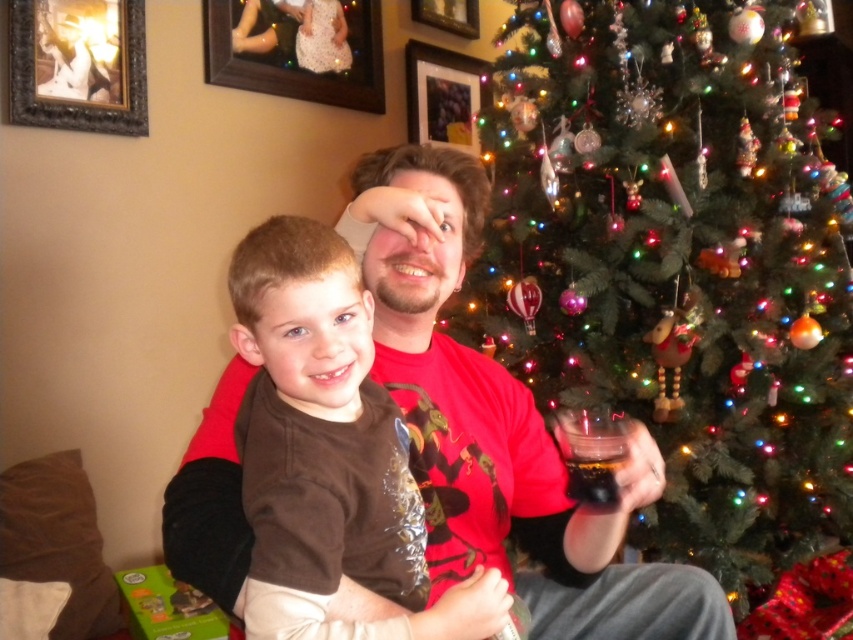
Can you confirm if red matte shirt at center is positioned to the left of metallic silver frame at upper center?

Indeed, red matte shirt at center is positioned on the left side of metallic silver frame at upper center.

Between point (456, 180) and point (444, 72), which one is positioned behind?

The point (444, 72) is behind.

This screenshot has width=853, height=640. I want to click on red matte shirt at center, so click(498, 426).

This screenshot has width=853, height=640. I want to click on red matte shirt at center, so click(498, 426).

Who is lower down, red matte shirt at center or matte glass picture frame at upper center?

red matte shirt at center

Who is more distant from viewer, (x=613, y=540) or (x=367, y=8)?

Positioned behind is point (x=367, y=8).

This screenshot has width=853, height=640. Identify the location of red matte shirt at center. (498, 426).

Is matte glass picture frame at upper center above translucent plastic cup at right?

Yes, matte glass picture frame at upper center is above translucent plastic cup at right.

Which is more to the left, matte glass picture frame at upper center or translucent plastic cup at right?

matte glass picture frame at upper center is more to the left.

What do you see at coordinates (297, 49) in the screenshot? This screenshot has width=853, height=640. I see `matte glass picture frame at upper center` at bounding box center [297, 49].

Find the location of a particular element. matte glass picture frame at upper center is located at coordinates (297, 49).